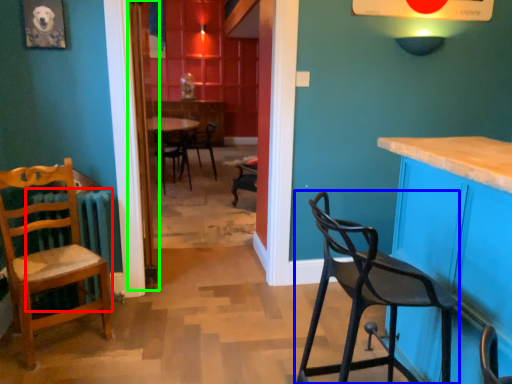
Question: Estimate the real-world distances between objects in this image. Which object is farther from radiator (highlighted by a red box), chair (highlighted by a blue box) or door (highlighted by a green box)?

Choices:
 (A) chair
 (B) door

Answer: (A)